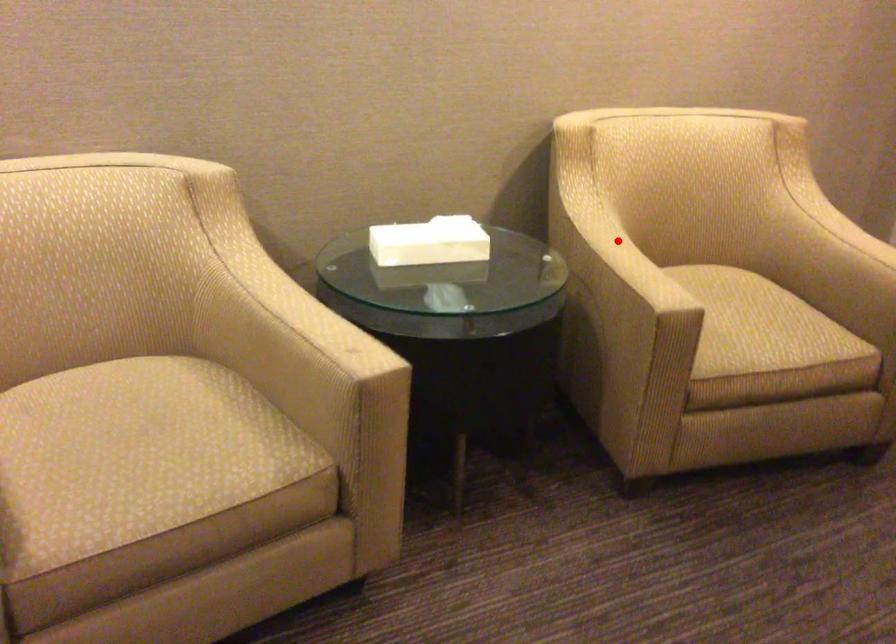
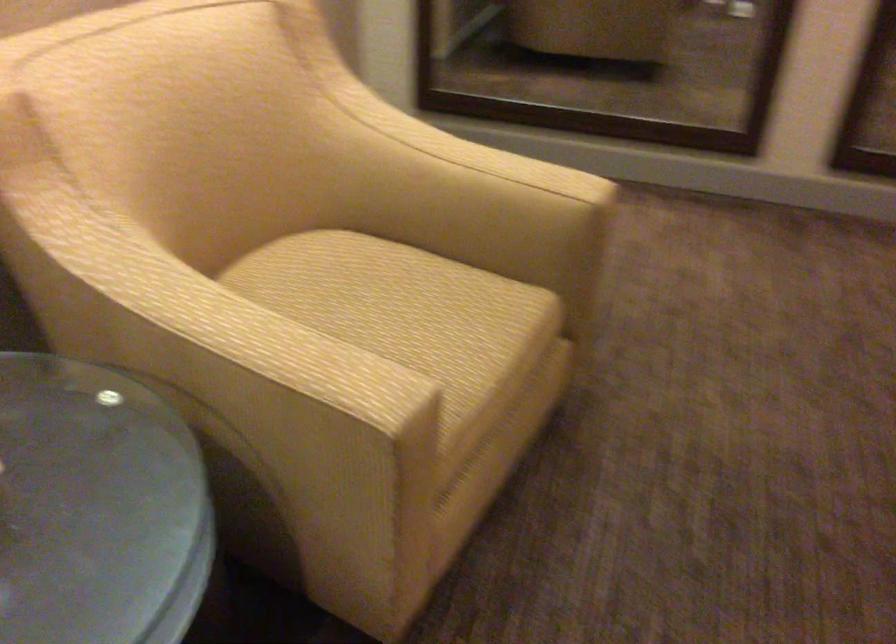
Find the pixel in the second image that matches the highlighted location in the first image.

(214, 313)